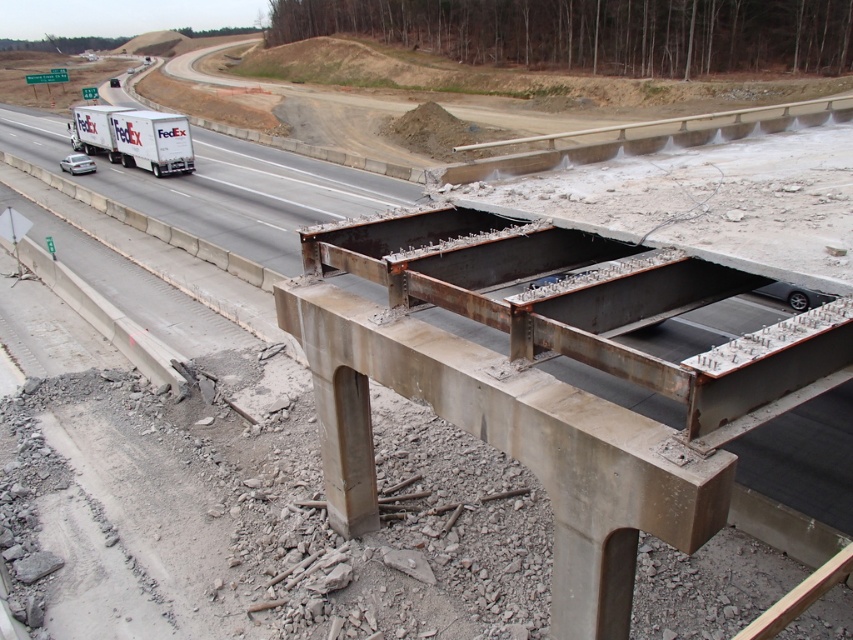
Question: Which of these objects is positioned closest to the white matte truck at left?

Choices:
 (A) matte white trailer truck at left
 (B) rusty metal bridge at center

Answer: (A)

Question: Which object is the closest to the white matte truck at left?

Choices:
 (A) rusty metal bridge at center
 (B) matte white trailer truck at left

Answer: (B)

Question: Does white matte truck at left come in front of matte white trailer truck at left?

Choices:
 (A) no
 (B) yes

Answer: (B)

Question: Can you confirm if white matte truck at left is positioned to the right of matte white trailer truck at left?

Choices:
 (A) no
 (B) yes

Answer: (B)

Question: Can you confirm if white matte truck at left is thinner than matte white trailer truck at left?

Choices:
 (A) yes
 (B) no

Answer: (B)

Question: Which of the following is the farthest from the observer?

Choices:
 (A) rusty metal bridge at center
 (B) white matte truck at left

Answer: (B)